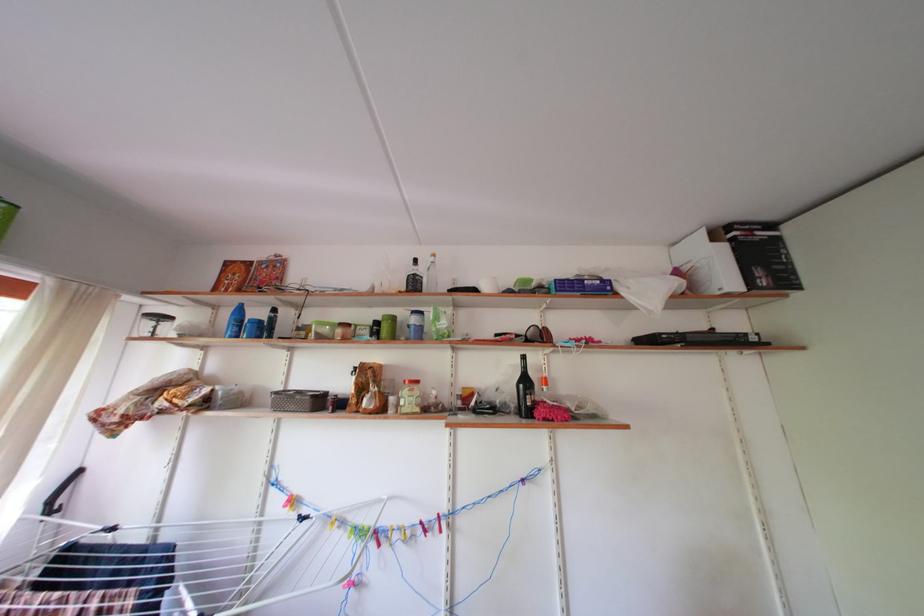
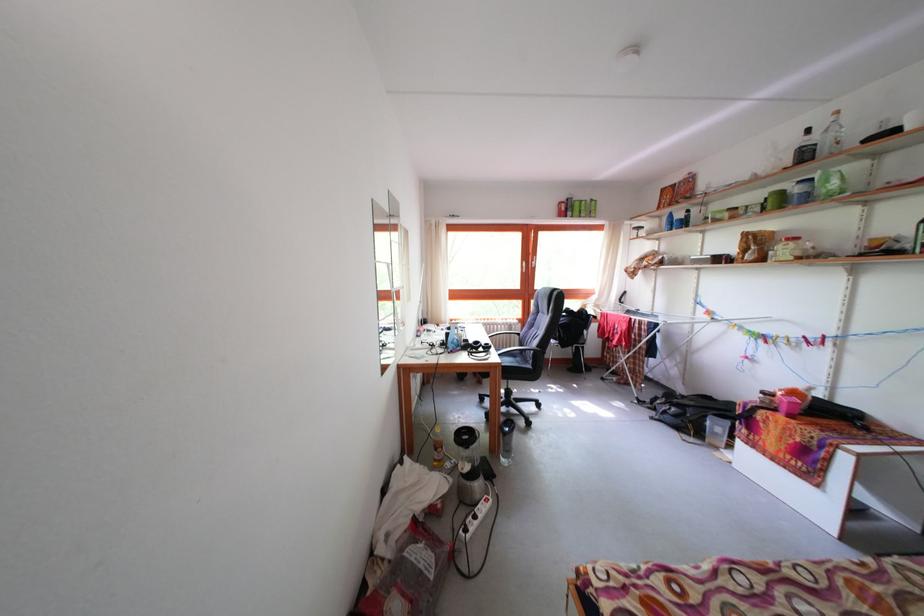
In the second image, find the point that corresponds to point (224, 313) in the first image.

(667, 224)